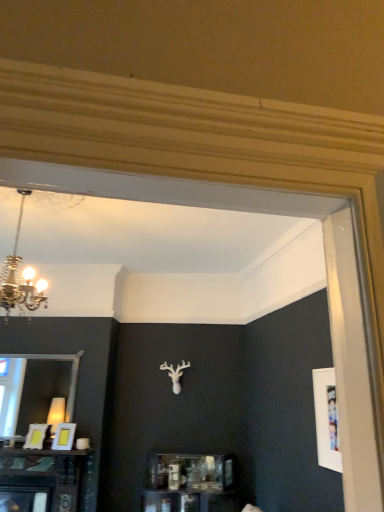
Question: Looking at their shapes, would you say matte yellow picture frame at lower left, the second picture frame positioned from the right, is wider or thinner than matte white picture frame at lower left, positioned as the second picture frame in left-to-right order?

Choices:
 (A) thin
 (B) wide

Answer: (A)

Question: Looking at the image, does matte yellow picture frame at lower left, marked as the first picture frame in a left-to-right arrangement, seem bigger or smaller compared to matte white picture frame at lower left, acting as the 1th picture frame starting from the right?

Choices:
 (A) small
 (B) big

Answer: (A)

Question: From a real-world perspective, is matte yellow picture frame at lower left, the second picture frame positioned from the right, positioned above or below matte white picture frame at lower left, acting as the 1th picture frame starting from the right?

Choices:
 (A) below
 (B) above

Answer: (A)

Question: Is matte white picture frame at lower left, positioned as the second picture frame in left-to-right order, inside or outside of matte yellow picture frame at lower left, marked as the first picture frame in a left-to-right arrangement?

Choices:
 (A) inside
 (B) outside

Answer: (B)

Question: Relative to matte yellow picture frame at lower left, the second picture frame positioned from the right, is matte white picture frame at lower left, acting as the 1th picture frame starting from the right, in front or behind?

Choices:
 (A) behind
 (B) front

Answer: (B)

Question: Is matte white picture frame at lower left, positioned as the second picture frame in left-to-right order, bigger or smaller than matte yellow picture frame at lower left, marked as the first picture frame in a left-to-right arrangement?

Choices:
 (A) big
 (B) small

Answer: (A)

Question: From a real-world perspective, is matte white picture frame at lower left, positioned as the second picture frame in left-to-right order, positioned above or below matte yellow picture frame at lower left, marked as the first picture frame in a left-to-right arrangement?

Choices:
 (A) below
 (B) above

Answer: (B)